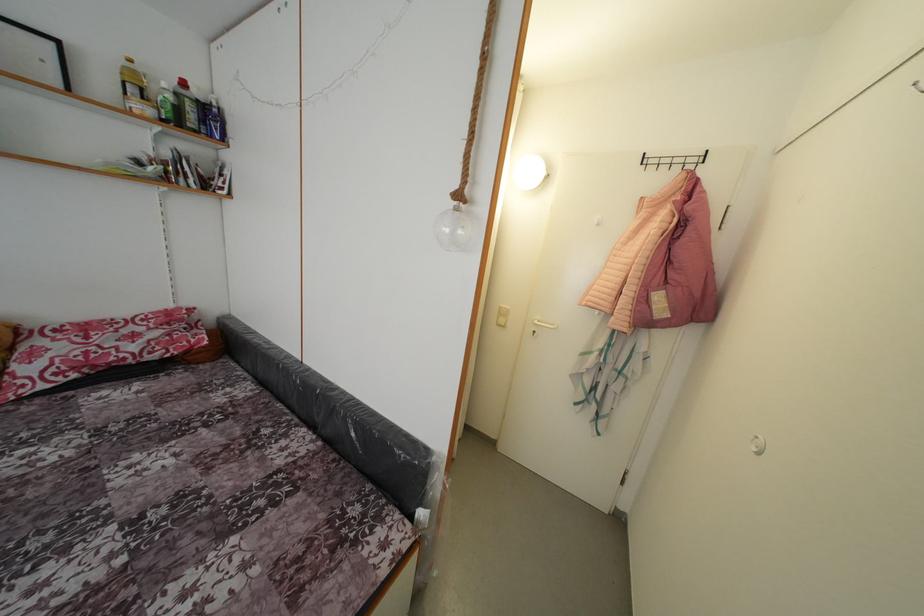
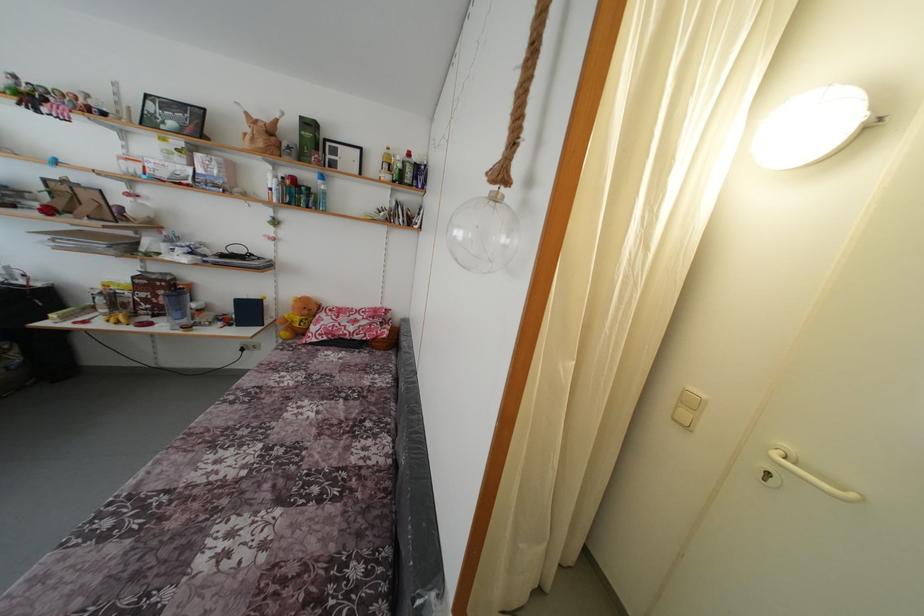
The point at (61, 346) is marked in the first image. Where is the corresponding point in the second image?

(332, 321)